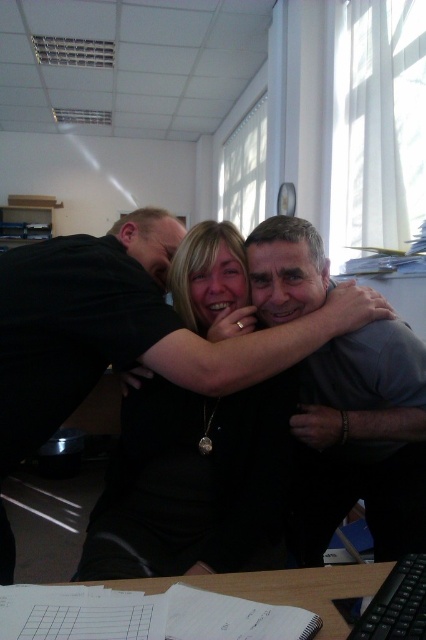
Does gray smooth shirt at center lie in front of black plastic keyboard at lower right?

No, it is behind black plastic keyboard at lower right.

Does gray smooth shirt at center appear over black plastic keyboard at lower right?

Correct, gray smooth shirt at center is located above black plastic keyboard at lower right.

I want to click on gray smooth shirt at center, so click(362, 442).

How much distance is there between black matte shirt at center and black plastic keyboard at lower right?

black matte shirt at center and black plastic keyboard at lower right are 24.03 inches apart from each other.

Does black matte shirt at center appear on the left side of black plastic keyboard at lower right?

Correct, you'll find black matte shirt at center to the left of black plastic keyboard at lower right.

Is point (195, 324) less distant than point (383, 614)?

That is False.

The height and width of the screenshot is (640, 426). I want to click on black matte shirt at center, so pos(192,481).

Between point (100, 637) and point (391, 609), which one is positioned in front?

Point (100, 637)

Is point (155, 604) more distant than point (373, 616)?

Yes, it is behind point (373, 616).

Identify the location of wooden table at lower center. (147, 614).